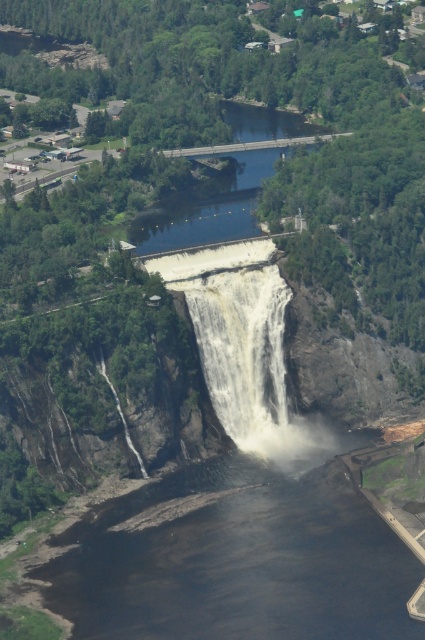
Describe the element at coordinates (235, 560) in the screenshot. The image size is (425, 640). I see `dark water at lower left` at that location.

Does dark water at lower left lie behind clear water at center?

No, dark water at lower left is in front of clear water at center.

You are a GUI agent. You are given a task and a screenshot of the screen. Output one action in this format:
    pyautogui.click(x=<x>, y=<y>)
    Task: Click on the dark water at lower left
    The image size is (425, 640).
    Given the screenshot: What is the action you would take?
    pyautogui.click(x=235, y=560)

Who is more forward, (x=337, y=595) or (x=243, y=301)?

Point (x=337, y=595)

Does dark water at lower left have a greater width compared to white frothy water at center?

Indeed, dark water at lower left has a greater width compared to white frothy water at center.

Between point (159, 483) and point (275, 394), which one is positioned in front?

Point (159, 483) is in front.

Image resolution: width=425 pixels, height=640 pixels. Find the location of `dark water at lower left`. dark water at lower left is located at coordinates (235, 560).

You are a GUI agent. You are given a task and a screenshot of the screen. Output one action in this format:
    pyautogui.click(x=<x>, y=<y>)
    Task: Click on the white frothy water at center
    
    Given the screenshot: What is the action you would take?
    pyautogui.click(x=243, y=353)

Is white frothy water at center behind clear water at center?

No, white frothy water at center is in front of clear water at center.

The height and width of the screenshot is (640, 425). Identify the location of white frothy water at center. (243, 353).